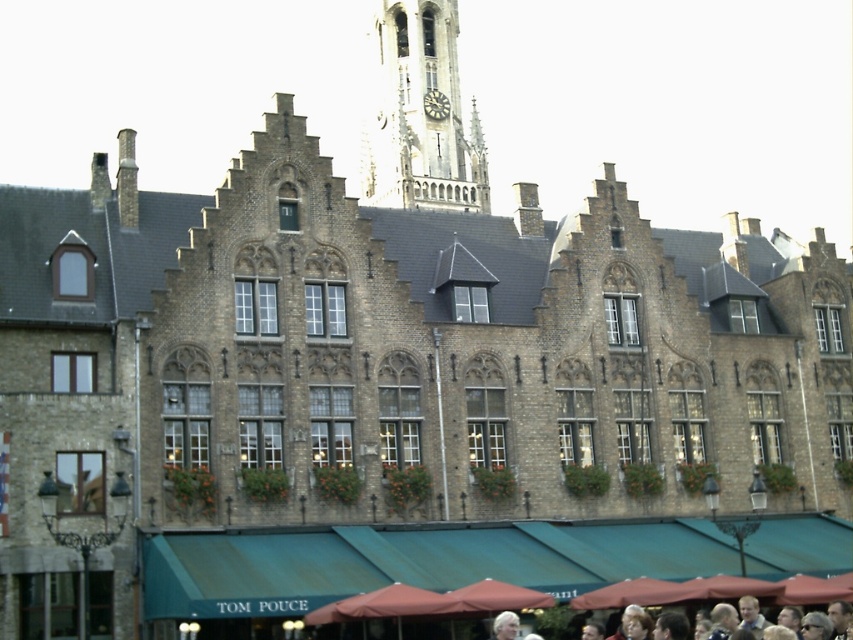
Question: Where is stone clock tower at upper center located in relation to dark gray stone clock at center in the image?

Choices:
 (A) above
 (B) below

Answer: (B)

Question: Which object appears closest to the camera in this image?

Choices:
 (A) stone clock tower at upper center
 (B) dark gray stone clock at center

Answer: (A)

Question: Does stone clock tower at upper center appear on the right side of dark gray stone clock at center?

Choices:
 (A) no
 (B) yes

Answer: (A)

Question: Where is stone clock tower at upper center located in relation to dark gray stone clock at center in the image?

Choices:
 (A) below
 (B) above

Answer: (A)

Question: Which object appears farthest from the camera in this image?

Choices:
 (A) stone clock tower at upper center
 (B) dark gray stone clock at center

Answer: (B)